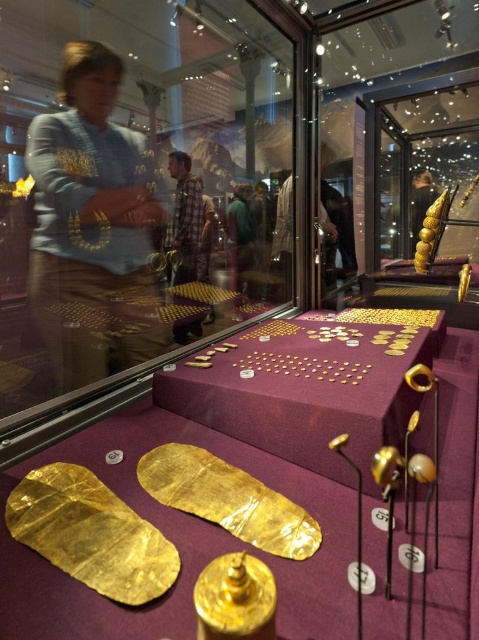
You are a museum visitor standing in front of the display case. You notice the purple velvet table at center. Can you determine its exact location within the case?

The purple velvet table at center is located at point coordinates of (305, 390).

You are a museum visitor who wants to know if the matte gold necklace at upper left can be seen from the same angle as the green fabric jacket at center. Based on their sizes, which one is bigger?

The matte gold necklace at upper left is larger in size than the green fabric jacket at center, so it can be seen more prominently from the same angle.